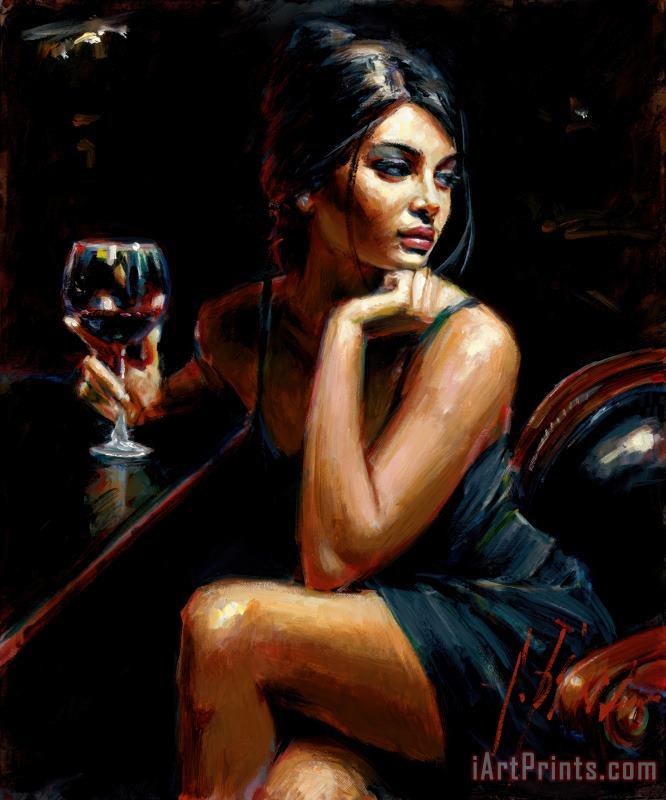
You are a GUI agent. You are given a task and a screenshot of the screen. Output one action in this format:
    pyautogui.click(x=<x>, y=<y>)
    Task: Click on the bar
    This screenshot has height=800, width=666.
    Given the screenshot: What is the action you would take?
    pyautogui.click(x=90, y=506)